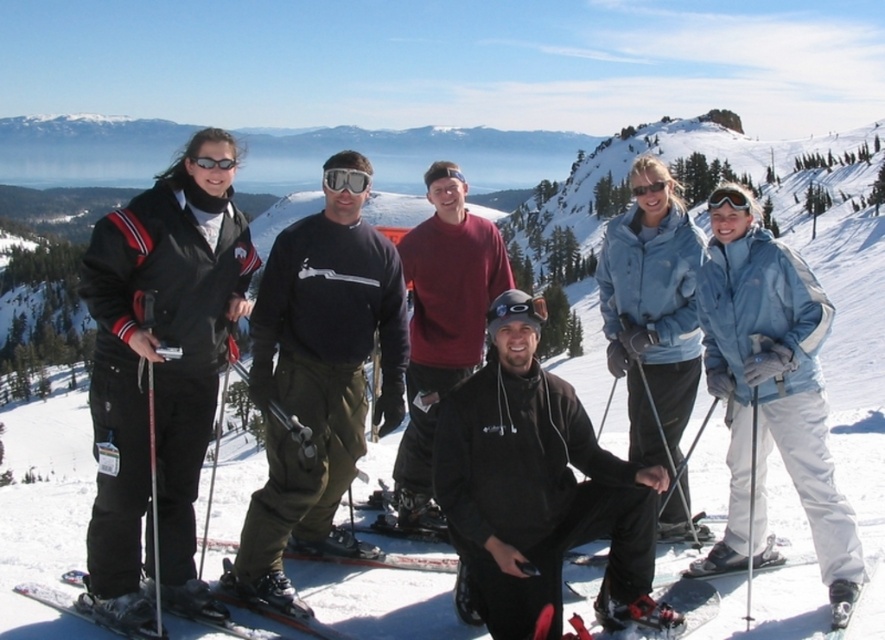
Question: Can you confirm if light blue waterproof jacket at right is thinner than red plastic ski at lower center?

Choices:
 (A) no
 (B) yes

Answer: (A)

Question: Which object is closer to the camera taking this photo?

Choices:
 (A) light blue waterproof jacket at right
 (B) clear plastic goggles at center

Answer: (A)

Question: Observing the image, what is the correct spatial positioning of light blue waterproof jacket at right in reference to red plastic ski at lower center?

Choices:
 (A) right
 (B) left

Answer: (A)

Question: Which of the following is the closest to the observer?

Choices:
 (A) clear plastic goggles at center
 (B) dark green pants at center

Answer: (B)

Question: From the image, what is the correct spatial relationship of dark green pants at center in relation to light blue waterproof jacket at right?

Choices:
 (A) above
 (B) below

Answer: (A)

Question: Estimate the real-world distances between objects in this image. Which object is farther from the dark green pants at center?

Choices:
 (A) maroon sweater at center
 (B) clear plastic goggles at center
 (C) red plastic ski at lower center
 (D) black matte jacket at center

Answer: (D)